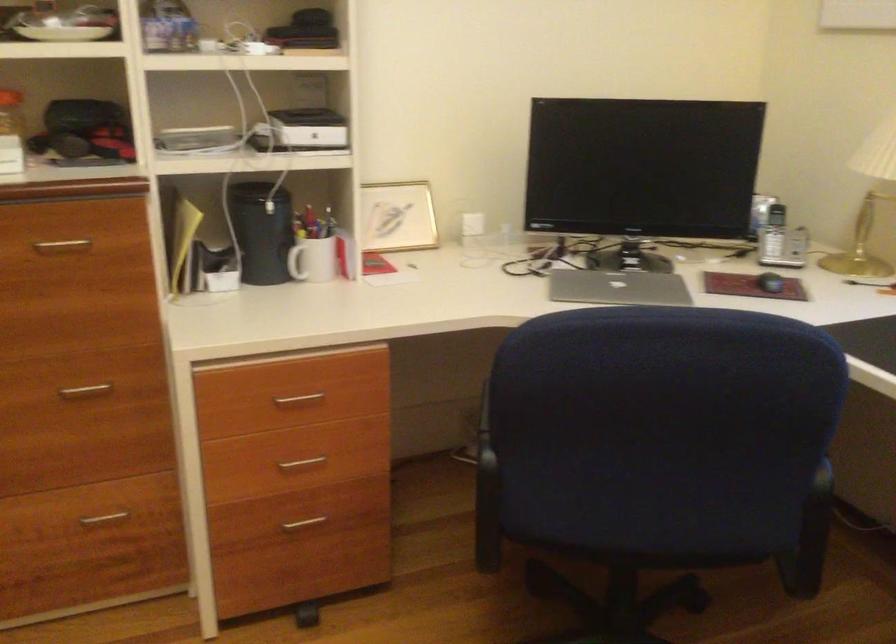
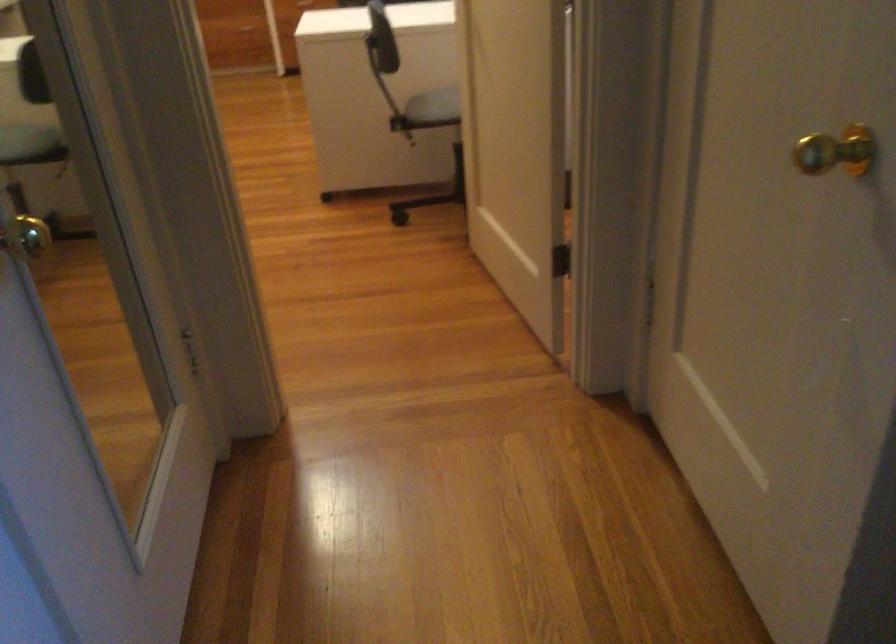
From the picture: The images are taken continuously from a first-person perspective. In which direction are you moving?

The cameraman walked toward right, backward.